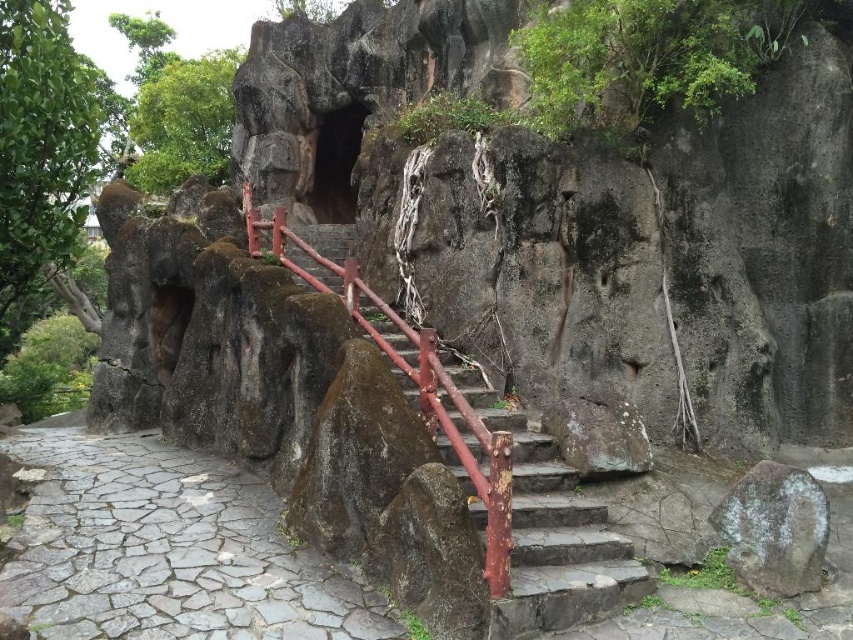
In the scene shown: You are a hiker planning to walk from the gray rough rock at lower right to the gray stone path at lower left. Which direction should you head to reach the path?

The gray stone path at lower left is larger in size than the gray rough rock at lower right, so you should head towards the left to reach the path.

You are a hiker planning to take a photo of the gray stone path at lower left and the gray rough rock at lower right from the cave entrance. Which object will appear smaller in the photo?

The gray stone path at lower left will appear smaller in the photo because it is not as tall as the gray rough rock at lower right.